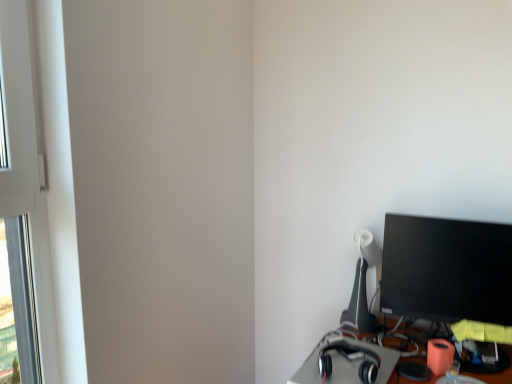
Question: From the image's perspective, is satin black headphones at lower right below white plastic window frame at left?

Choices:
 (A) no
 (B) yes

Answer: (B)

Question: Can you see satin black headphones at lower right touching white plastic window frame at left?

Choices:
 (A) yes
 (B) no

Answer: (B)

Question: Is satin black headphones at lower right facing away from white plastic window frame at left?

Choices:
 (A) yes
 (B) no

Answer: (B)

Question: Is the depth of satin black headphones at lower right less than that of white plastic window frame at left?

Choices:
 (A) yes
 (B) no

Answer: (B)

Question: Can you confirm if satin black headphones at lower right is thinner than white plastic window frame at left?

Choices:
 (A) no
 (B) yes

Answer: (A)

Question: Is satin black headphones at lower right wider than white plastic window frame at left?

Choices:
 (A) yes
 (B) no

Answer: (A)

Question: Is white plastic window frame at left surrounding black glossy monitor at right?

Choices:
 (A) no
 (B) yes

Answer: (A)

Question: Is white plastic window frame at left outside black glossy monitor at right?

Choices:
 (A) no
 (B) yes

Answer: (B)

Question: Is white plastic window frame at left aimed at black glossy monitor at right?

Choices:
 (A) yes
 (B) no

Answer: (B)

Question: Is white plastic window frame at left placed right next to black glossy monitor at right?

Choices:
 (A) yes
 (B) no

Answer: (B)

Question: Can you confirm if white plastic window frame at left is positioned to the left of black glossy monitor at right?

Choices:
 (A) yes
 (B) no

Answer: (A)

Question: Is white plastic window frame at left far away from black glossy monitor at right?

Choices:
 (A) no
 (B) yes

Answer: (B)

Question: From a real-world perspective, is matte black table lamp at right under satin black headphones at lower right?

Choices:
 (A) yes
 (B) no

Answer: (B)